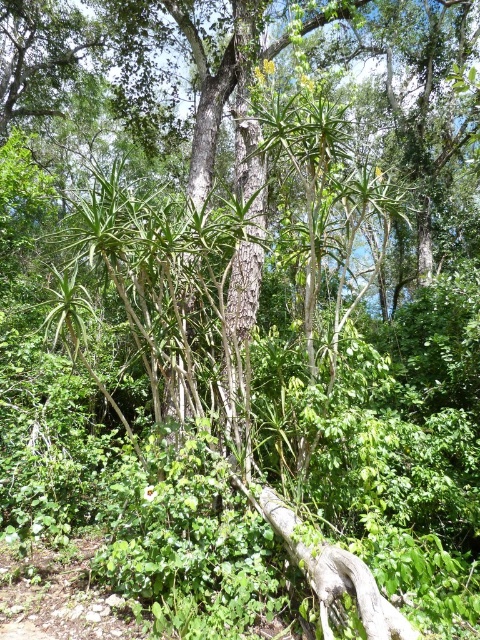
You are a hiker trying to determine which object is narrower between the smooth bark tree trunk at center and the gray rough log at center. Based on the scene, which one is narrower?

The smooth bark tree trunk at center has a lesser width compared to the gray rough log at center, so the smooth bark tree trunk at center is narrower.

You are a hiker trying to navigate through the forest. You see a smooth bark tree trunk at center and a gray rough log at center. Which one is taller?

The smooth bark tree trunk at center is much taller than the gray rough log at center.